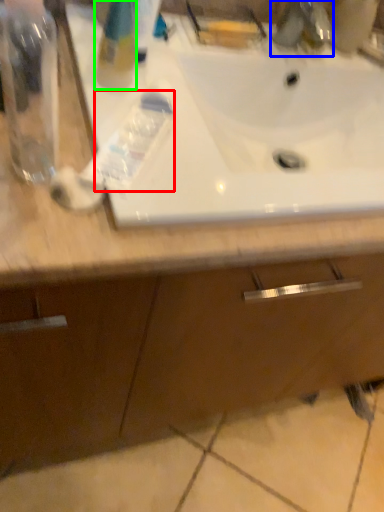
Question: Considering the real-world distances, which object is farthest from toothpaste (highlighted by a red box)? plumbing fixture (highlighted by a blue box) or cleaning product (highlighted by a green box)?

Choices:
 (A) plumbing fixture
 (B) cleaning product

Answer: (A)